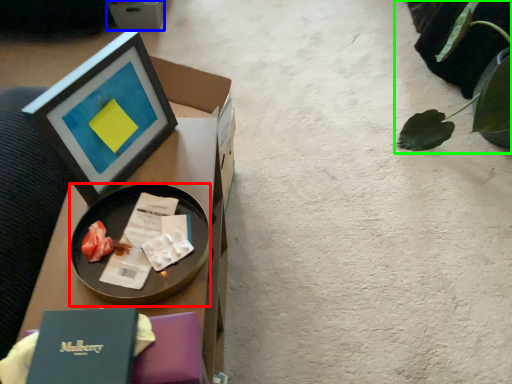
Question: Which is nearer to the tableware (highlighted by a red box)? cardboard box (highlighted by a blue box) or plant (highlighted by a green box).

Choices:
 (A) cardboard box
 (B) plant

Answer: (B)